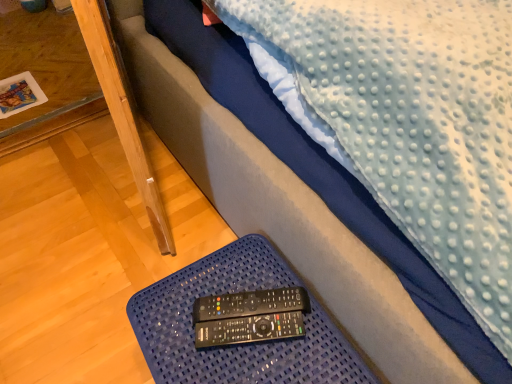
At what (x,y) coordinates should I click in order to perform the action: click on vacant space behind black plastic remote at lower center, the 2th control when ordered from back to front. Please return your answer as a coordinate pair (x, y). Looking at the image, I should click on (242, 270).